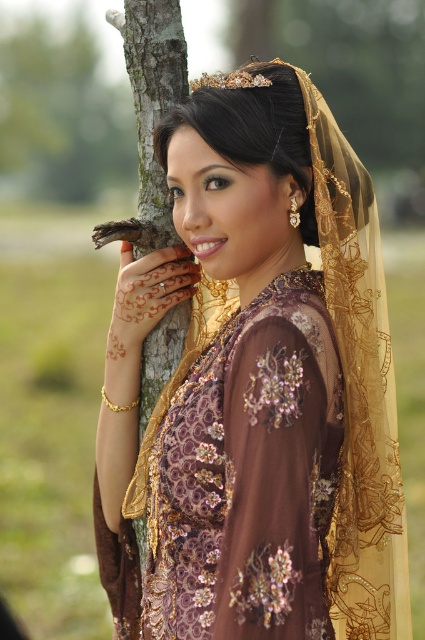
Who is shorter, brown embroidered dress at center or matte gold headscarf at upper center?

Standing shorter between the two is matte gold headscarf at upper center.

Can you confirm if brown embroidered dress at center is positioned above matte gold headscarf at upper center?

→ Incorrect, brown embroidered dress at center is not positioned above matte gold headscarf at upper center.

Is point (393, 568) closer to viewer compared to point (209, 124)?

No, (393, 568) is behind (209, 124).

The height and width of the screenshot is (640, 425). Find the location of `brown embroidered dress at center`. brown embroidered dress at center is located at coordinates [257, 385].